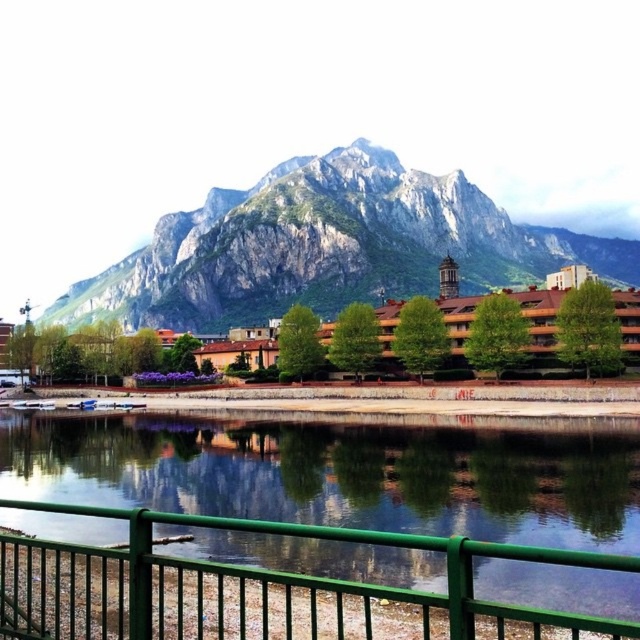
You are standing at the point with coordinates point (262, 307) and want to walk towards the mountain in the background. Is the point with coordinates point (605, 440) blocking your path?

Point (605, 440) is in front of point (262, 307), so yes, the point with coordinates point (605, 440) is blocking your path.

You are a tourist standing on the paved walkway next to the calm body of water. You want to take a photo that captures both the rugged stone mountain at upper center and the brown wooden houses at center in the same frame. Considering their heights, which object will appear taller in your photo?

The rugged stone mountain at upper center will appear taller in the photo because it has a greater height compared to the brown wooden houses at center.

You are a hiker planning to cross the green metallic river at center and the rugged stone mountain at upper center. Which path requires more horizontal space to traverse?

The rugged stone mountain at upper center requires more horizontal space to traverse because it has a greater width than the green metallic river at center.